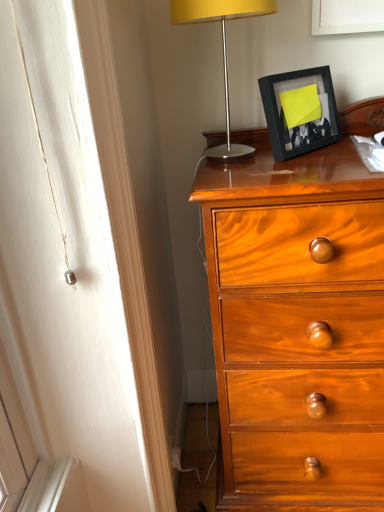
Question: In terms of height, does metallic silver lamp at upper right look taller or shorter compared to black matte picture frame at upper right?

Choices:
 (A) short
 (B) tall

Answer: (B)

Question: In the image, is metallic silver lamp at upper right on the left side or the right side of black matte picture frame at upper right?

Choices:
 (A) right
 (B) left

Answer: (B)

Question: Is point (193, 0) closer or farther from the camera than point (299, 83)?

Choices:
 (A) closer
 (B) farther

Answer: (A)

Question: Would you say black matte picture frame at upper right is inside or outside metallic silver lamp at upper right?

Choices:
 (A) outside
 (B) inside

Answer: (A)

Question: Considering the positions of black matte picture frame at upper right and metallic silver lamp at upper right in the image, is black matte picture frame at upper right taller or shorter than metallic silver lamp at upper right?

Choices:
 (A) short
 (B) tall

Answer: (A)

Question: Considering the positions of black matte picture frame at upper right and metallic silver lamp at upper right in the image, is black matte picture frame at upper right wider or thinner than metallic silver lamp at upper right?

Choices:
 (A) thin
 (B) wide

Answer: (A)

Question: In the image, is black matte picture frame at upper right positioned in front of or behind metallic silver lamp at upper right?

Choices:
 (A) behind
 (B) front

Answer: (A)